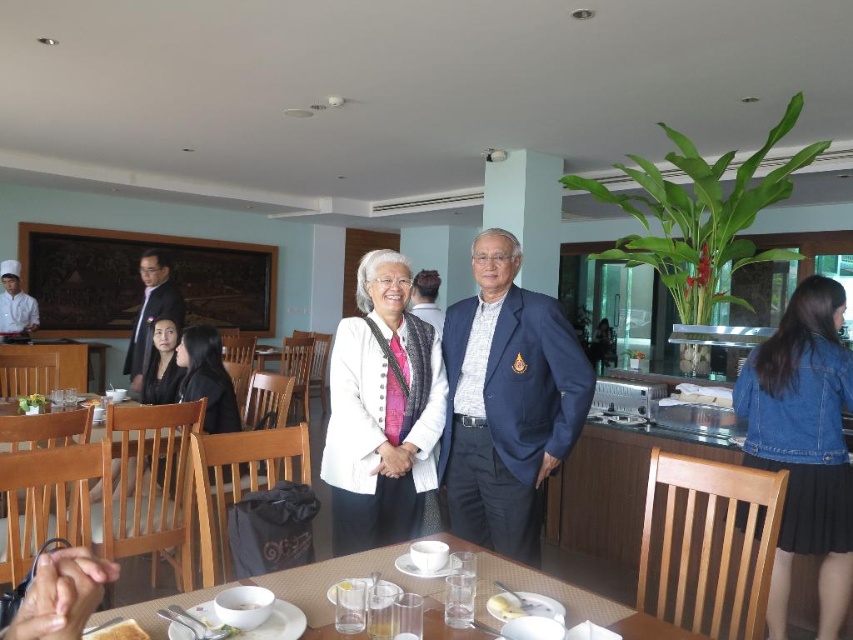
Question: Is denim jacket at lower right bigger than black fabric jacket at lower left?

Choices:
 (A) yes
 (B) no

Answer: (A)

Question: Which object is positioned closest to the navy blue suit at center?

Choices:
 (A) dark blue suit at center
 (B) matte black blazer at center
 (C) denim jacket at lower right

Answer: (C)

Question: Which is nearer to the denim jacket at lower right?

Choices:
 (A) matte black blazer at center
 (B) white textured sweater at center
 (C) dark blue suit at center
 (D) black fabric jacket at lower left

Answer: (B)

Question: Which of the following is the closest to the observer?

Choices:
 (A) matte black blazer at center
 (B) matte white chef's uniform at left
 (C) black fabric jacket at lower left

Answer: (C)

Question: Is denim jacket at lower right above matte white chef's uniform at left?

Choices:
 (A) no
 (B) yes

Answer: (A)

Question: Can you confirm if navy blue suit at center is thinner than brown wooden table at lower center?

Choices:
 (A) yes
 (B) no

Answer: (A)